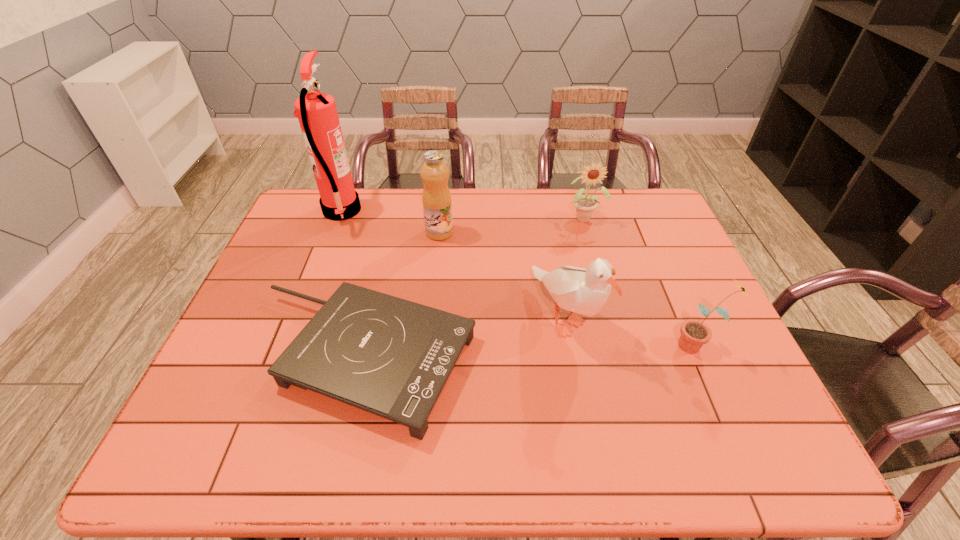
Find the location of a particular element. Image resolution: width=960 pixels, height=540 pixels. free location that satisfies the following two spatial constraints: 1. with the nozzle aimed from the fire extinguisher; 2. on the right side of the shortest object is located at coordinates (284, 359).

Where is `free point that satisfies the following two spatial constraints: 1. with the nozzle aimed from the hotplate; 2. on the left side of the tallest object`? The width and height of the screenshot is (960, 540). free point that satisfies the following two spatial constraints: 1. with the nozzle aimed from the hotplate; 2. on the left side of the tallest object is located at coordinates (284, 359).

This screenshot has height=540, width=960. In order to click on vacant area in the image that satisfies the following two spatial constraints: 1. with the nozzle aimed from the fire extinguisher; 2. on the right side of the shortest object in this screenshot , I will do `click(284, 359)`.

Where is `vacant space that satisfies the following two spatial constraints: 1. on the front-facing side of the left sunflower; 2. on the front label of the fruit juice`? vacant space that satisfies the following two spatial constraints: 1. on the front-facing side of the left sunflower; 2. on the front label of the fruit juice is located at coordinates (589, 233).

You are a GUI agent. You are given a task and a screenshot of the screen. Output one action in this format:
    pyautogui.click(x=<x>, y=<y>)
    Task: Click on the vacant space that satisfies the following two spatial constraints: 1. on the front label of the fruit juice; 2. on the front side of the hotplate
    
    Given the screenshot: What is the action you would take?
    pyautogui.click(x=426, y=359)

Where is `free space in the image that satisfies the following two spatial constraints: 1. on the flower of the right sunflower; 2. on the front side of the shortest object`? This screenshot has width=960, height=540. free space in the image that satisfies the following two spatial constraints: 1. on the flower of the right sunflower; 2. on the front side of the shortest object is located at coordinates (703, 359).